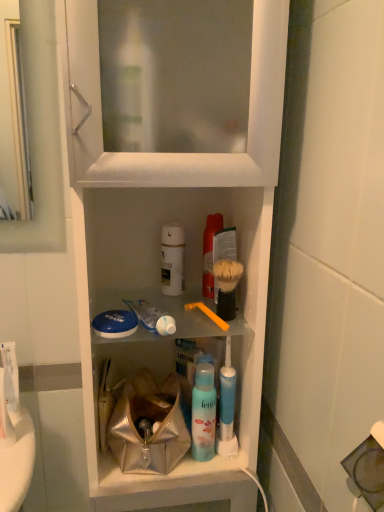
Question: Is white plastic cabinet at center thinner than white glossy toothpaste at center?

Choices:
 (A) yes
 (B) no

Answer: (B)

Question: Is white plastic cabinet at center looking in the opposite direction of white glossy toothpaste at center?

Choices:
 (A) yes
 (B) no

Answer: (A)

Question: Does white plastic cabinet at center have a greater width compared to white glossy toothpaste at center?

Choices:
 (A) no
 (B) yes

Answer: (B)

Question: Does white plastic cabinet at center touch white glossy toothpaste at center?

Choices:
 (A) no
 (B) yes

Answer: (A)

Question: Can you confirm if white plastic cabinet at center is positioned to the left of white glossy toothpaste at center?

Choices:
 (A) yes
 (B) no

Answer: (A)

Question: Looking at the image, does white matte bottle at center, positioned as the 2th mouthwash in top-to-bottom order, seem bigger or smaller compared to orange plastic toothbrush at center?

Choices:
 (A) small
 (B) big

Answer: (B)

Question: Considering the relative positions of white matte bottle at center, positioned as the 2th mouthwash in top-to-bottom order, and orange plastic toothbrush at center in the image provided, is white matte bottle at center, positioned as the 2th mouthwash in top-to-bottom order, to the left or to the right of orange plastic toothbrush at center?

Choices:
 (A) left
 (B) right

Answer: (A)

Question: In the image, is white matte bottle at center, which is the 2th mouthwash in bottom-to-top order, positioned in front of or behind orange plastic toothbrush at center?

Choices:
 (A) behind
 (B) front

Answer: (A)

Question: Considering the positions of point (173, 287) and point (188, 305), is point (173, 287) closer or farther from the camera than point (188, 305)?

Choices:
 (A) farther
 (B) closer

Answer: (A)

Question: From the image's perspective, is white glossy toothpaste at center located above or below white matte bottle at center, positioned as the 2th mouthwash in top-to-bottom order?

Choices:
 (A) below
 (B) above

Answer: (A)

Question: From a real-world perspective, is white glossy toothpaste at center physically located above or below white matte bottle at center, which is the 2th mouthwash in bottom-to-top order?

Choices:
 (A) below
 (B) above

Answer: (A)

Question: Considering the relative positions of white glossy toothpaste at center and white matte bottle at center, which is the 2th mouthwash in bottom-to-top order, in the image provided, is white glossy toothpaste at center to the left or to the right of white matte bottle at center, which is the 2th mouthwash in bottom-to-top order,?

Choices:
 (A) right
 (B) left

Answer: (B)

Question: Considering the positions of point (150, 308) and point (162, 273), is point (150, 308) closer or farther from the camera than point (162, 273)?

Choices:
 (A) closer
 (B) farther

Answer: (A)

Question: Is white glossy toothpaste at center in front of or behind blue matte mouthwash at center, marked as the 3th mouthwash in a top-to-bottom arrangement, in the image?

Choices:
 (A) front
 (B) behind

Answer: (A)

Question: In terms of size, does white glossy toothpaste at center appear bigger or smaller than blue matte mouthwash at center, placed as the first mouthwash when sorted from bottom to top?

Choices:
 (A) small
 (B) big

Answer: (A)